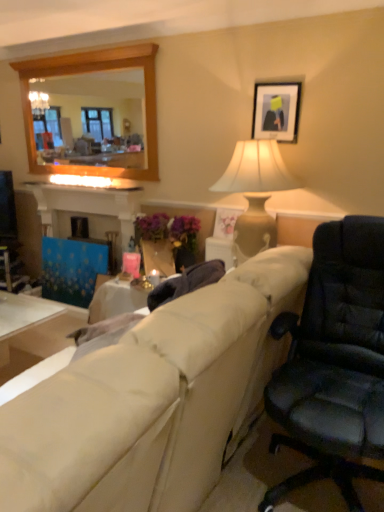
Question: Can you confirm if white glossy table at lower left is wider than beige fabric couch at center?

Choices:
 (A) no
 (B) yes

Answer: (A)

Question: From the image's perspective, is white glossy table at lower left located beneath beige fabric couch at center?

Choices:
 (A) no
 (B) yes

Answer: (B)

Question: Does white glossy table at lower left have a larger size compared to beige fabric couch at center?

Choices:
 (A) yes
 (B) no

Answer: (B)

Question: From the image's perspective, is white glossy table at lower left above beige fabric couch at center?

Choices:
 (A) no
 (B) yes

Answer: (A)

Question: Is white glossy table at lower left in front of beige fabric couch at center?

Choices:
 (A) yes
 (B) no

Answer: (B)

Question: Considering the relative sizes of white glossy table at lower left and beige fabric couch at center in the image provided, is white glossy table at lower left taller than beige fabric couch at center?

Choices:
 (A) yes
 (B) no

Answer: (B)

Question: Does wooden frame mirror at upper left turn towards matte black picture frame at upper center?

Choices:
 (A) no
 (B) yes

Answer: (A)

Question: From the image's perspective, is wooden frame mirror at upper left over matte black picture frame at upper center?

Choices:
 (A) yes
 (B) no

Answer: (A)

Question: Is matte black picture frame at upper center surrounded by wooden frame mirror at upper left?

Choices:
 (A) no
 (B) yes

Answer: (A)

Question: Is wooden frame mirror at upper left further to the viewer compared to matte black picture frame at upper center?

Choices:
 (A) yes
 (B) no

Answer: (A)

Question: Can you confirm if wooden frame mirror at upper left is thinner than matte black picture frame at upper center?

Choices:
 (A) no
 (B) yes

Answer: (A)

Question: From a real-world perspective, is wooden frame mirror at upper left on matte black picture frame at upper center?

Choices:
 (A) yes
 (B) no

Answer: (A)

Question: From the image's perspective, is matte beige vase at center located above wooden frame mirror at upper left?

Choices:
 (A) no
 (B) yes

Answer: (A)